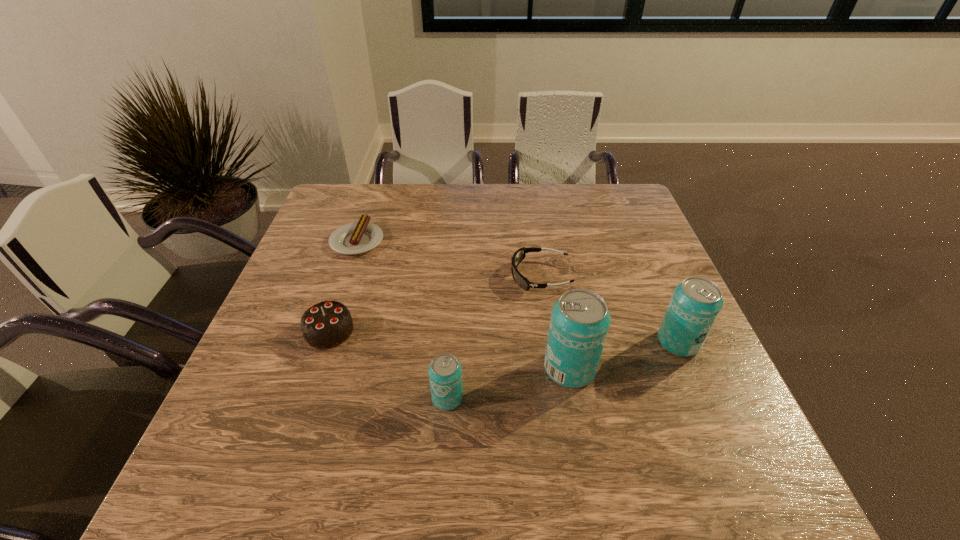
Locate an element on the screen. This screenshot has width=960, height=540. free space between the fifth tallest object and the chocolate cake is located at coordinates (435, 303).

In order to click on blank region between the goggles and the shortest object in this screenshot , I will do (449, 258).

Locate an element on the screen. blank region between the sausage and the goggles is located at coordinates (449, 258).

Find the location of a particular element. The width and height of the screenshot is (960, 540). vacant area that lies between the second beer can from left to right and the second tallest beer can is located at coordinates (624, 355).

In order to click on free space between the shortest object and the rightmost object in this screenshot , I will do `click(517, 291)`.

This screenshot has height=540, width=960. What are the coordinates of `vacant space in between the second beer can from right to left and the chocolate cake` in the screenshot? It's located at (449, 350).

Image resolution: width=960 pixels, height=540 pixels. What are the coordinates of `vacant space that is in between the second beer can from left to right and the chocolate cake` in the screenshot? It's located at (449, 350).

Identify the location of empty location between the sausage and the rightmost beer can. This screenshot has height=540, width=960. (517, 291).

Locate an element on the screen. This screenshot has width=960, height=540. object that stands as the closest to the shortest object is located at coordinates (327, 324).

Identify which object is located as the nearest to the fourth object from right to left. Please provide its 2D coordinates. Your answer should be formatted as a tuple, i.e. [(x, y)], where the tuple contains the x and y coordinates of a point satisfying the conditions above.

[(579, 323)]